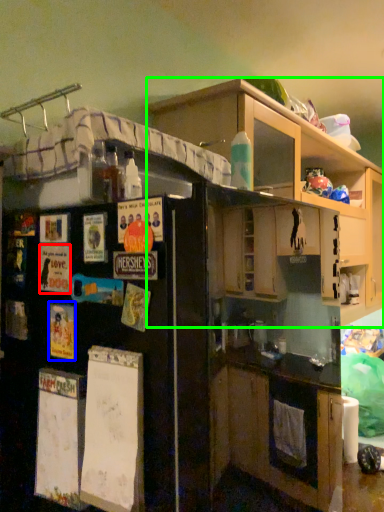
Question: Which object is positioned closest to poster (highlighted by a red box)? Select from poster (highlighted by a blue box) and cabinetry (highlighted by a green box).

Choices:
 (A) poster
 (B) cabinetry

Answer: (A)